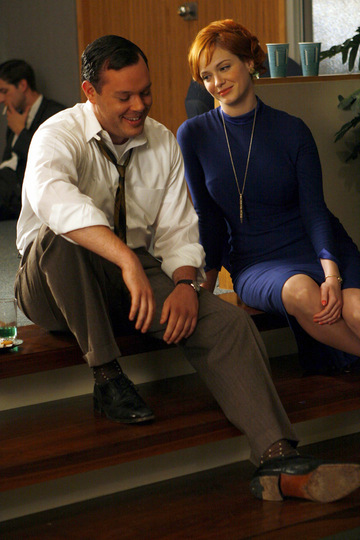
Identify the location of pendant. (239, 210).